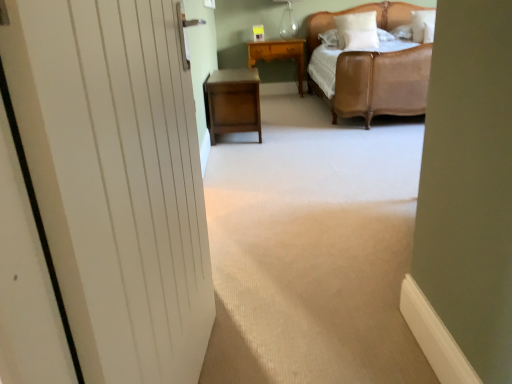
This screenshot has width=512, height=384. I want to click on vacant area that is in front of wooden nightstand at center, positioned as the first nightstand in bottom-to-top order, so tap(261, 147).